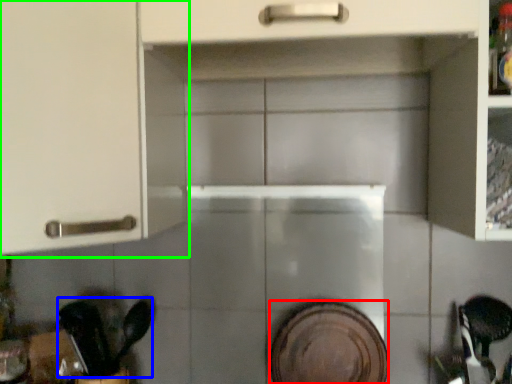
Question: Which is nearer to the platter (highlighted by a red box)? tableware (highlighted by a blue box) or cabinetry (highlighted by a green box).

Choices:
 (A) tableware
 (B) cabinetry

Answer: (A)